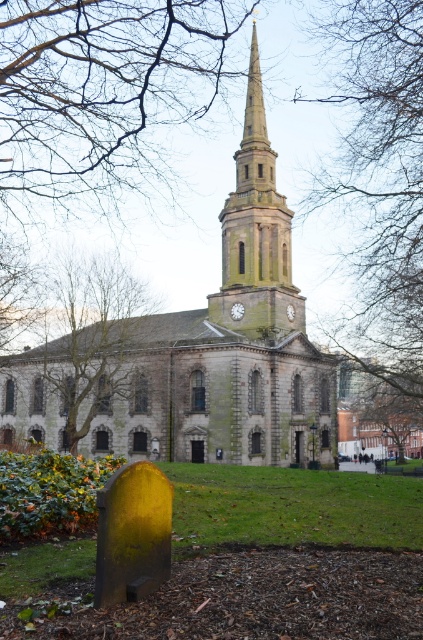
Is point (82, 344) farther from camera compared to point (253, 125)?

That is False.

Between brown textured tree at left and smooth stone steeple at center, which one is positioned lower?

Positioned lower is brown textured tree at left.

Locate an element on the screen. The width and height of the screenshot is (423, 640). brown textured tree at left is located at coordinates (87, 344).

Is point (283, 243) farther from viewer compared to point (118, 328)?

Yes.

Between point (43, 388) and point (63, 376), which one is positioned behind?

Positioned behind is point (43, 388).

The image size is (423, 640). Find the location of `stone church at center`. stone church at center is located at coordinates (227, 344).

Does bare branches at upper center have a lesser height compared to smooth stone steeple at center?

No, bare branches at upper center is not shorter than smooth stone steeple at center.

Can you confirm if bare branches at upper center is positioned to the left of smooth stone steeple at center?

No, bare branches at upper center is not to the left of smooth stone steeple at center.

The height and width of the screenshot is (640, 423). What do you see at coordinates (381, 188) in the screenshot? I see `bare branches at upper center` at bounding box center [381, 188].

Image resolution: width=423 pixels, height=640 pixels. In order to click on bare branches at upper center in this screenshot , I will do `click(381, 188)`.